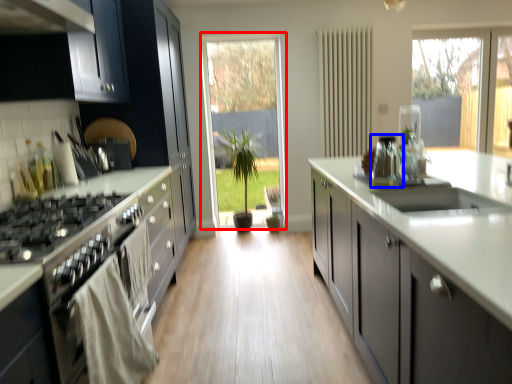
Question: Which point is closer to the camera, glass door (highlighted by a red box) or appliance (highlighted by a blue box)?

Choices:
 (A) glass door
 (B) appliance

Answer: (B)